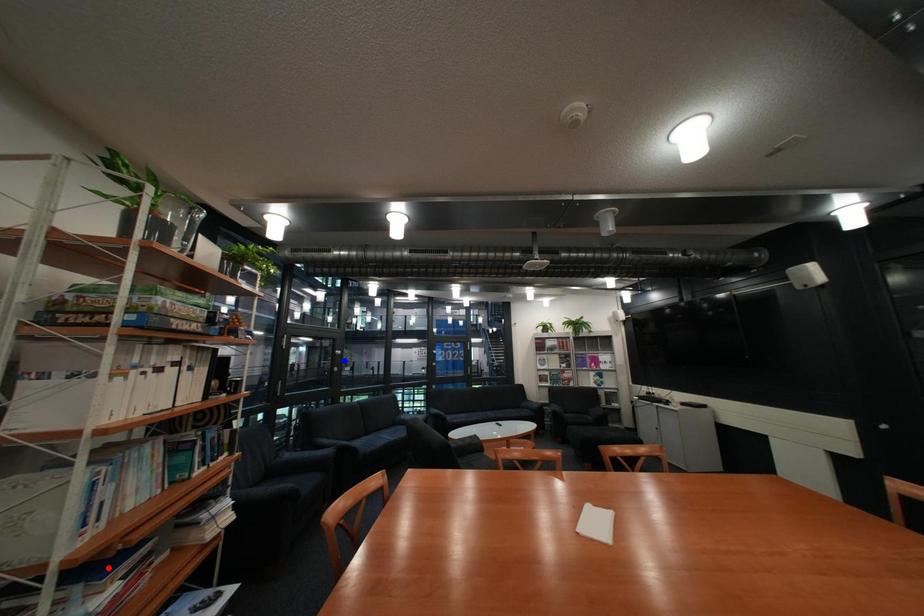
Question: Which of the two points in the image is closer to the camera?

Choices:
 (A) Blue point is closer.
 (B) Red point is closer.

Answer: (B)